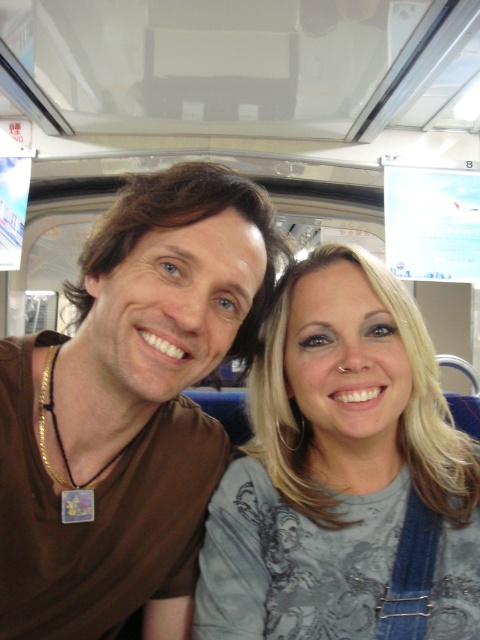
Which is in front, point (227, 202) or point (360, 266)?

Point (227, 202) is in front.

Based on the photo, who is higher up, brown matte shirt at center or gray fabric shirt at center?

brown matte shirt at center is above.

Who is more distant from viewer, (213, 480) or (263, 452)?

Point (263, 452)

Where is `brown matte shirt at center`? The image size is (480, 640). brown matte shirt at center is located at coordinates (130, 403).